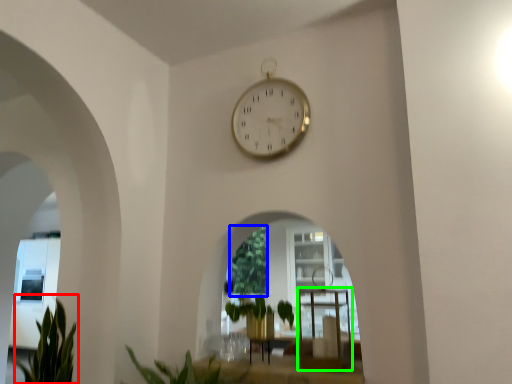
Question: Which object is positioned farthest from plant (highlighted by a red box)? Select from vegetation (highlighted by a blue box) and table (highlighted by a green box).

Choices:
 (A) vegetation
 (B) table

Answer: (B)